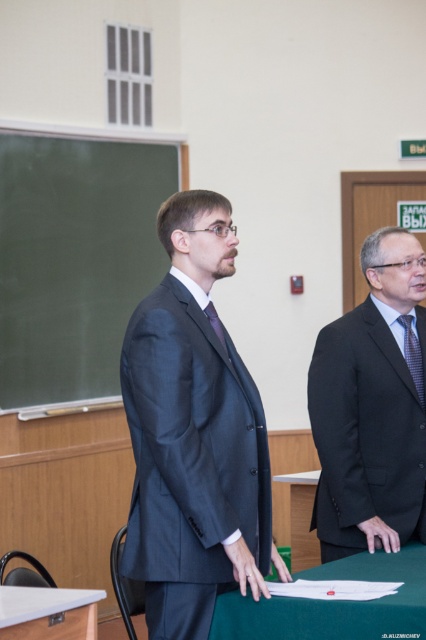
Question: Which object is farther from the camera taking this photo?

Choices:
 (A) dark blue suit at center
 (B) green laminate table at lower left

Answer: (B)

Question: Which of the following is the closest to the observer?

Choices:
 (A) (213, 404)
 (B) (402, 609)

Answer: (B)

Question: Can you confirm if green fabric table at center is positioned to the left of green laminate table at lower left?

Choices:
 (A) no
 (B) yes

Answer: (A)

Question: Where is dark blue suit at center located in relation to green chalkboard at left in the image?

Choices:
 (A) below
 (B) above

Answer: (A)

Question: Is dark blue suit at center above green fabric table at center?

Choices:
 (A) yes
 (B) no

Answer: (A)

Question: Which point is closer to the camera?

Choices:
 (A) dark gray suit at right
 (B) green laminate table at lower left
 (C) green chalkboard at left
 (D) dark blue suit at center

Answer: (D)